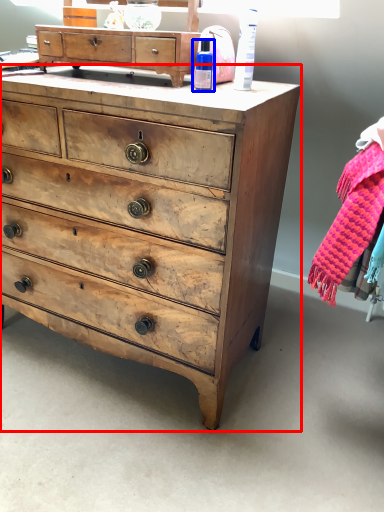
Question: Which object appears closest to the camera in this image, chest of drawers (highlighted by a red box) or toiletry (highlighted by a blue box)?

Choices:
 (A) chest of drawers
 (B) toiletry

Answer: (A)